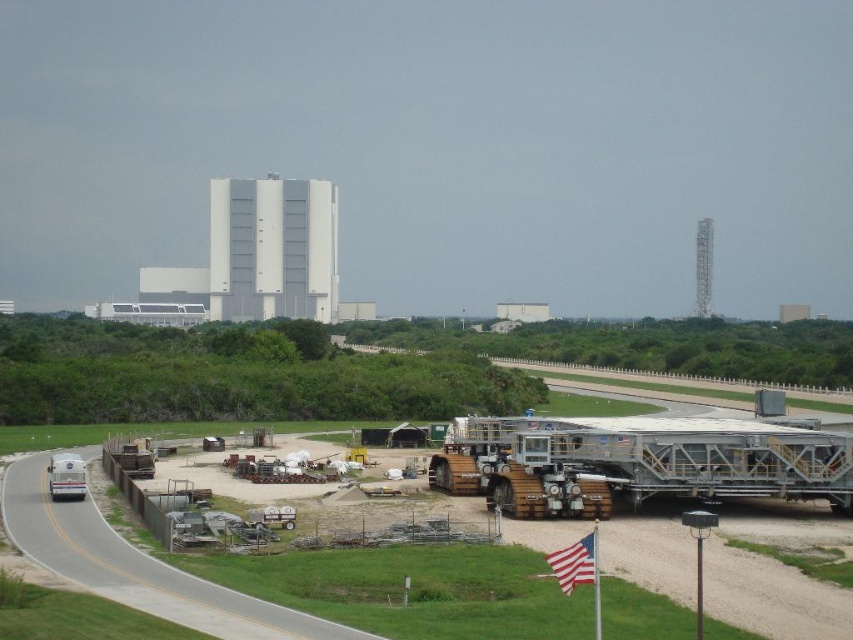
From the picture: You are planning to move the metallic gray construction equipment at lower center and the metallic gray trailer truck at center right to a different location. Given the space constraints of the industrial area, which object would require more space to maneuver around the curved road?

The metallic gray trailer truck at center right requires more space to maneuver around the curved road because it occupies more space than the metallic gray construction equipment at lower center.

You are a drone operator tasked with capturing aerial footage of the industrial area. Your camera has a limited field of view and can only focus on one object at a time. Which object should you prioritize filming first between the gray asphalt highway at lower left and the american flag at lower right if you need to capture the larger object?

The gray asphalt highway at lower left is bigger than the american flag at lower right, so you should prioritize filming the gray asphalt highway at lower left first.

In the scene shown: You are standing at the entrance of the industrial area and want to locate two specific points marked in the image. Which of the two points, point 1 at coordinates point (x=747, y=577) or point 2 at coordinates point (x=527, y=436), is closer to your current position?

A: Point 1 at coordinates point (x=747, y=577) is closer to your current position because it is closer to the camera than point 2 at coordinates point (x=527, y=436).